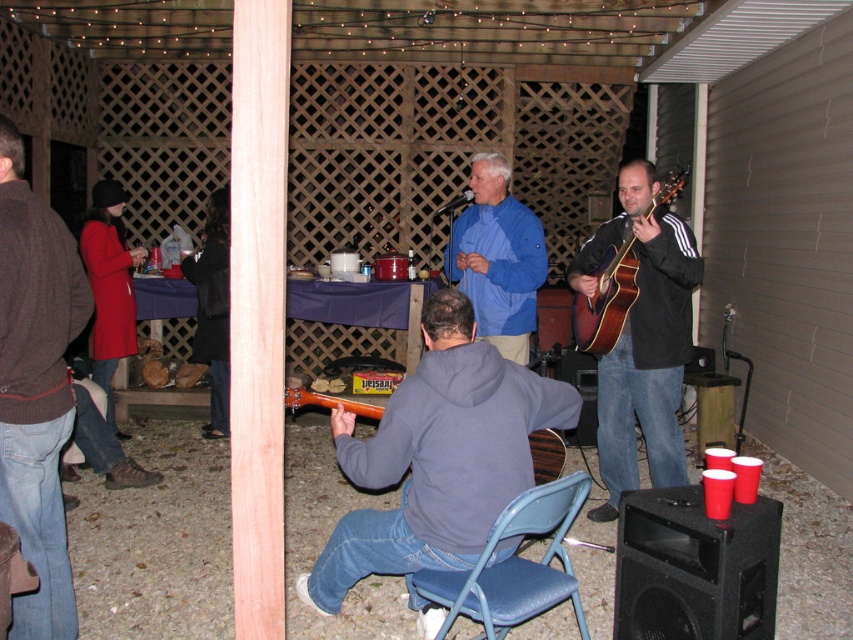
Between point (567, 488) and point (196, 342), which one is positioned in front?

Point (567, 488) is more forward.

Is the position of blue metal chair at center less distant than that of black leather jacket at upper left?

That is True.

You are a GUI agent. You are given a task and a screenshot of the screen. Output one action in this format:
    pyautogui.click(x=<x>, y=<y>)
    Task: Click on the blue metal chair at center
    This screenshot has height=640, width=853.
    Given the screenshot: What is the action you would take?
    pyautogui.click(x=514, y=564)

Is matte brown guitar at right taller than wooden acoustic guitar at center?

Yes, matte brown guitar at right is taller than wooden acoustic guitar at center.

Can you confirm if matte brown guitar at right is smaller than wooden acoustic guitar at center?

No.

Who is more forward, (674, 477) or (308, 388)?

Point (674, 477)

Find the location of a particular element. matte brown guitar at right is located at coordinates (642, 339).

Can you confirm if brown sweater at left is thinner than matte red coat at left?

Indeed, brown sweater at left has a lesser width compared to matte red coat at left.

Is brown sweater at left below matte red coat at left?

Correct, brown sweater at left is located below matte red coat at left.

Describe the element at coordinates (36, 387) in the screenshot. I see `brown sweater at left` at that location.

I want to click on brown sweater at left, so click(36, 387).